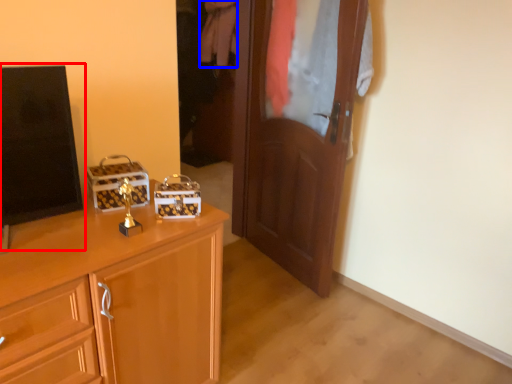
Question: Which object appears farthest to the camera in this image, tv show (highlighted by a red box) or clothing (highlighted by a blue box)?

Choices:
 (A) tv show
 (B) clothing

Answer: (B)